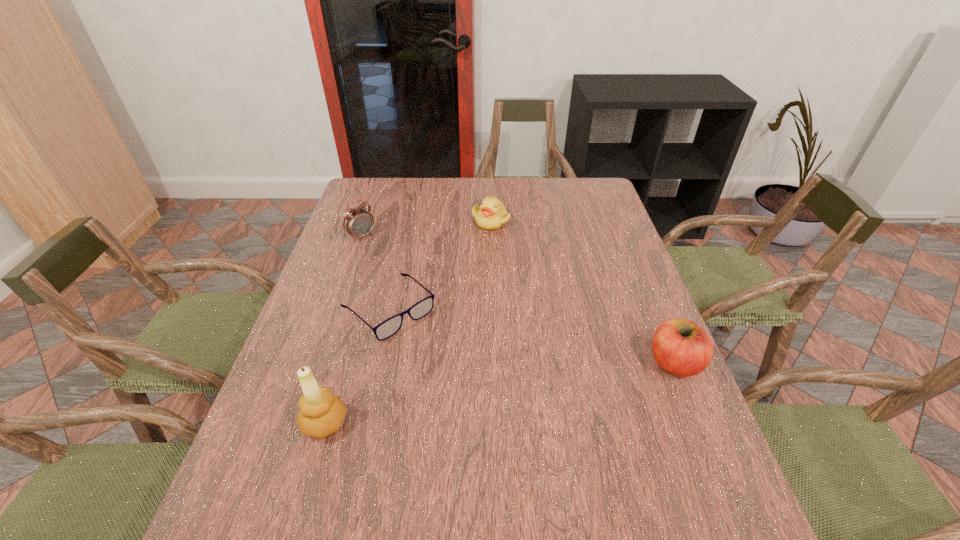
Locate which object is the closest to the apple. Please provide its 2D coordinates. Your answer should be formatted as a tuple, i.e. [(x, y)], where the tuple contains the x and y coordinates of a point satisfying the conditions above.

[(386, 329)]

This screenshot has height=540, width=960. I want to click on object that can be found as the third closest to the alarm clock, so click(321, 414).

Image resolution: width=960 pixels, height=540 pixels. I want to click on free space that satisfies the following two spatial constraints: 1. on the back side of the fourth object from left to right; 2. on the left side of the shortest object, so coord(408,221).

This screenshot has width=960, height=540. What are the coordinates of `free region that satisfies the following two spatial constraints: 1. on the front side of the shortest object; 2. on the right side of the rightmost object` in the screenshot? It's located at (376, 363).

In order to click on vacant area that satisfies the following two spatial constraints: 1. on the front side of the alarm clock; 2. on the left side of the rightmost object in this screenshot , I will do `click(318, 363)`.

Locate an element on the screen. free space that satisfies the following two spatial constraints: 1. on the back side of the rightmost object; 2. on the right side of the tallest object is located at coordinates (343, 363).